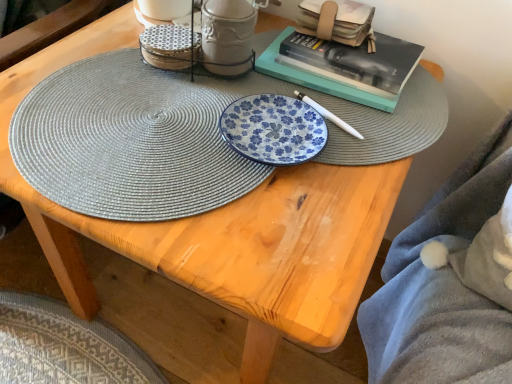
Question: From a real-world perspective, is soft gray plush blanket at lower right beneath matte ceramic mug at upper center, which is the second tableware in left-to-right order?

Choices:
 (A) no
 (B) yes

Answer: (B)

Question: From the image's perspective, is soft gray plush blanket at lower right located beneath matte ceramic mug at upper center, which is the second tableware in left-to-right order?

Choices:
 (A) no
 (B) yes

Answer: (B)

Question: Considering the relative sizes of soft gray plush blanket at lower right and matte ceramic mug at upper center, which is the second tableware in left-to-right order, in the image provided, is soft gray plush blanket at lower right smaller than matte ceramic mug at upper center, which is the second tableware in left-to-right order,?

Choices:
 (A) no
 (B) yes

Answer: (A)

Question: Is the surface of soft gray plush blanket at lower right in direct contact with matte ceramic mug at upper center, which is the second tableware in left-to-right order?

Choices:
 (A) yes
 (B) no

Answer: (B)

Question: Considering the relative sizes of soft gray plush blanket at lower right and matte ceramic mug at upper center, which ranks as the first tableware in right-to-left order, in the image provided, is soft gray plush blanket at lower right shorter than matte ceramic mug at upper center, which ranks as the first tableware in right-to-left order,?

Choices:
 (A) no
 (B) yes

Answer: (A)

Question: From a real-world perspective, is soft gray plush blanket at lower right over matte ceramic mug at upper center, which ranks as the first tableware in right-to-left order?

Choices:
 (A) no
 (B) yes

Answer: (A)

Question: Is hardcover book at upper right looking in the opposite direction of matte gray woven placemat at center?

Choices:
 (A) no
 (B) yes

Answer: (A)

Question: From a real-world perspective, is hardcover book at upper right on top of matte gray woven placemat at center?

Choices:
 (A) yes
 (B) no

Answer: (A)

Question: Would you consider hardcover book at upper right to be distant from matte gray woven placemat at center?

Choices:
 (A) no
 (B) yes

Answer: (A)

Question: Is matte gray woven placemat at center completely or partially inside hardcover book at upper right?

Choices:
 (A) no
 (B) yes

Answer: (A)

Question: Is hardcover book at upper right wider than matte gray woven placemat at center?

Choices:
 (A) no
 (B) yes

Answer: (A)

Question: Considering the relative positions of hardcover book at upper right and matte gray woven placemat at center in the image provided, is hardcover book at upper right behind matte gray woven placemat at center?

Choices:
 (A) yes
 (B) no

Answer: (A)

Question: Would you say soft gray plush blanket at lower right is part of matte ceramic mug at upper center, which is the second tableware in left-to-right order,'s contents?

Choices:
 (A) yes
 (B) no

Answer: (B)